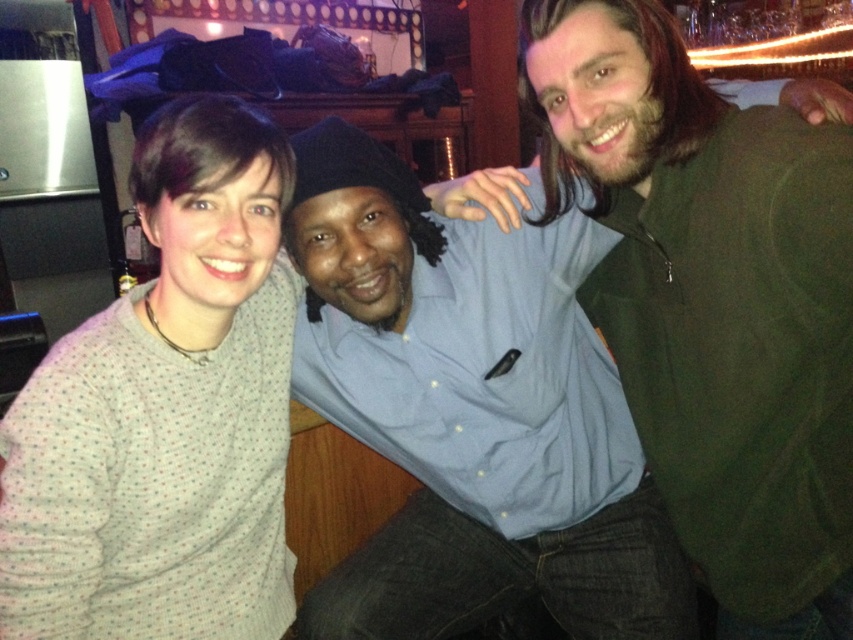
In the scene shown: Is green matte jacket at right in front of white dotted sweater at left?

That is True.

Identify the location of green matte jacket at right. (714, 301).

Find the location of a particular element. green matte jacket at right is located at coordinates (714, 301).

Which of these two, green matte jacket at right or blue button-down shirt at center, stands shorter?

blue button-down shirt at center

Which of these two, green matte jacket at right or blue button-down shirt at center, stands taller?

With more height is green matte jacket at right.

Who is more forward, (779, 196) or (473, 321)?

Point (779, 196) is in front.

The width and height of the screenshot is (853, 640). Identify the location of green matte jacket at right. (714, 301).

Who is more forward, (374, 257) or (206, 627)?

Point (374, 257) is in front.

Is blue button-down shirt at center shorter than white dotted sweater at left?

Yes, blue button-down shirt at center is shorter than white dotted sweater at left.

Is point (581, 228) behind point (218, 504)?

That is True.

Where is `blue button-down shirt at center`? blue button-down shirt at center is located at coordinates (471, 412).